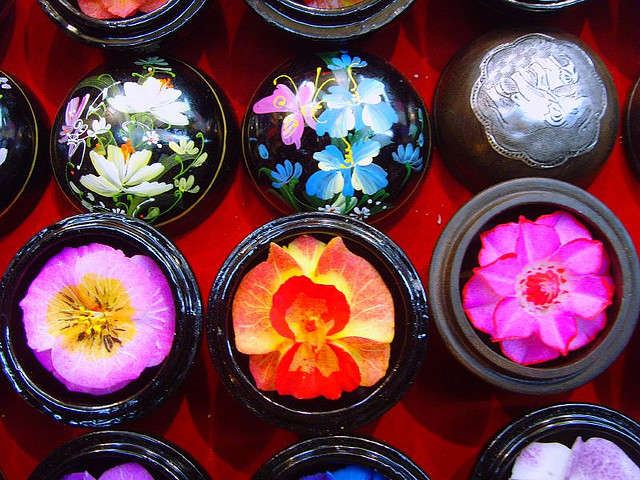
This screenshot has height=480, width=640. Identify the location of red tablecloth. (420, 219).